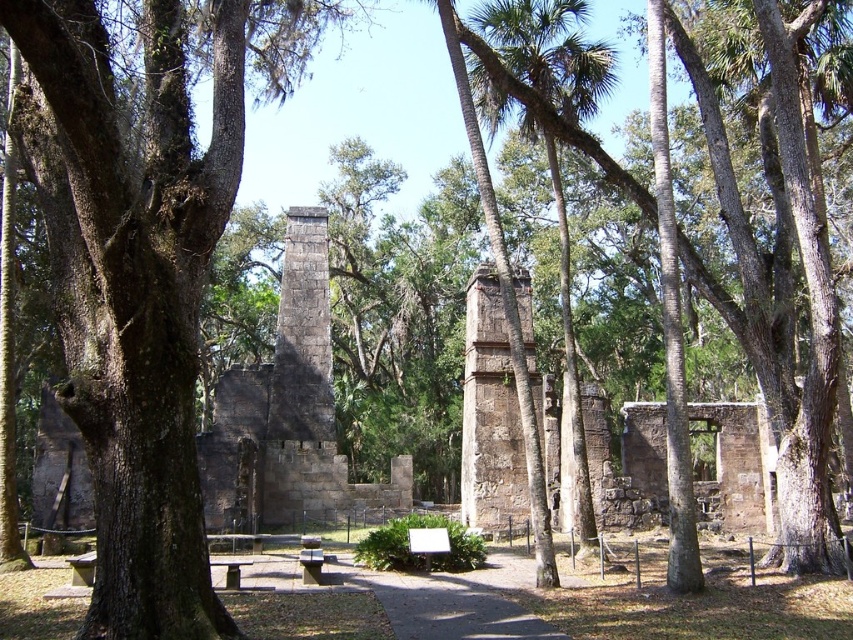
You are an archaeologist examining the historical site. You notice the green rough bark tree at left and the stone ruins at center. Which object is positioned higher in the image?

The green rough bark tree at left is above the stone ruins at center, so it is positioned higher in the image.

In the scene shown: You are an archaeologist examining the historical site. You notice the green rough bark tree at left and the stone ruins at center. Based on their positions, which object is closer to the right side of the image?

The green rough bark tree at left is to the right of the stone ruins at center, so it is closer to the right side of the image.

You are standing at point (140, 276) in the historical site. You want to move towards the green rough bark tree at left. Is the tree to your left or right side?

The green rough bark tree at left is located to your left side at point (140, 276).